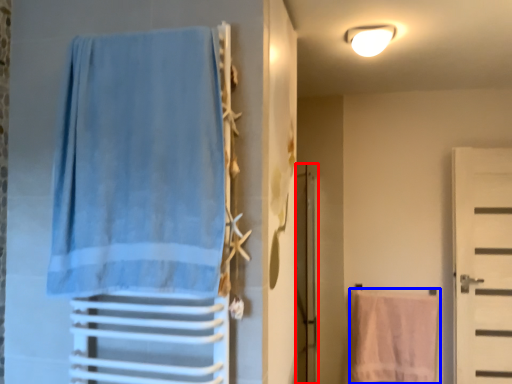
Question: Which object is further to the camera taking this photo, screen door (highlighted by a red box) or beach towel (highlighted by a blue box)?

Choices:
 (A) screen door
 (B) beach towel

Answer: (B)